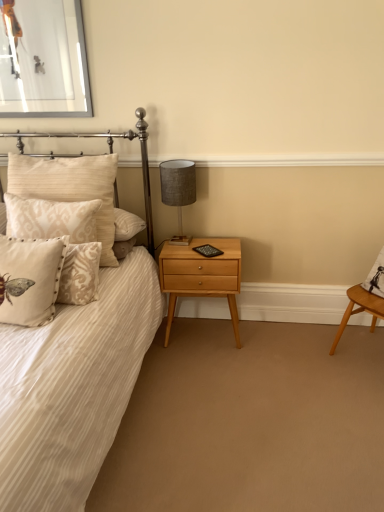
Question: Considering their positions, is beige velvet pillow at left, the 2th pillow when ordered from back to front, located in front of or behind beige textured pillow at left, arranged as the 3th pillow when viewed from the front?

Choices:
 (A) behind
 (B) front

Answer: (B)

Question: In terms of size, does beige velvet pillow at left, the 2th pillow when ordered from back to front, appear bigger or smaller than beige textured pillow at left, the 1th pillow from the back?

Choices:
 (A) small
 (B) big

Answer: (A)

Question: Considering the real-world distances, which object is farthest from the white striped fabric bed at left?

Choices:
 (A) light wood/texture nightstand at lower center
 (B) beige velvet pillow at left, the 2th pillow when ordered from back to front
 (C) beige textured pillow at left, arranged as the 3th pillow when viewed from the front
 (D) beige damask pillow at left, arranged as the first pillow when viewed from the front
 (E) textured gray lampshade at upper right

Answer: (E)

Question: Which object is the farthest from the beige textured pillow at left, the 1th pillow from the back?

Choices:
 (A) light wood/texture nightstand at lower center
 (B) textured gray lampshade at upper right
 (C) white striped fabric bed at left
 (D) metallic silver picture frame at upper left
 (E) beige damask pillow at left, the 3th pillow positioned from the back

Answer: (A)